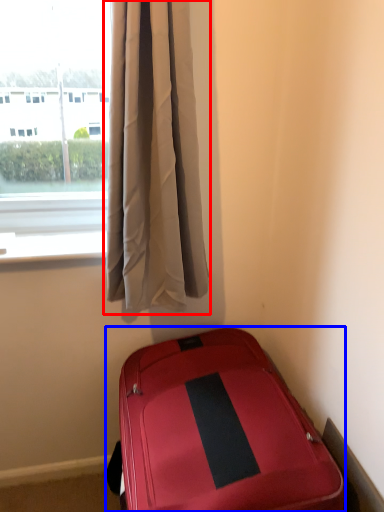
Question: Which object appears farthest to the camera in this image, curtain (highlighted by a red box) or suitcase (highlighted by a blue box)?

Choices:
 (A) curtain
 (B) suitcase

Answer: (A)